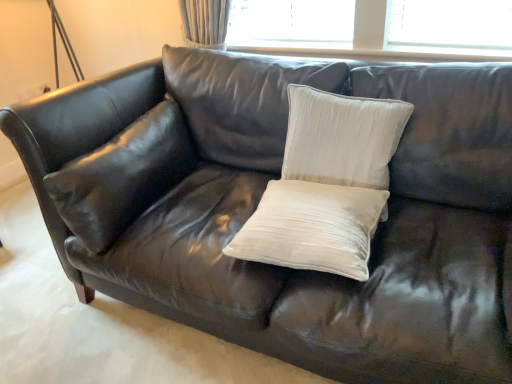
What do you see at coordinates (123, 176) in the screenshot? The width and height of the screenshot is (512, 384). I see `satin white pillow at center, which is the 1th pillow from left to right` at bounding box center [123, 176].

Where is `satin white pillow at center, which ranks as the second pillow in right-to-left order`? satin white pillow at center, which ranks as the second pillow in right-to-left order is located at coordinates (312, 228).

Is satin white pillow at center, acting as the 2th pillow starting from the left, oriented away from satin white pillow at center, which is the 1th pillow from left to right?

satin white pillow at center, acting as the 2th pillow starting from the left, is not turned away from satin white pillow at center, which is the 1th pillow from left to right.

Does point (263, 222) come farther from viewer compared to point (124, 209)?

No, (263, 222) is in front of (124, 209).

Considering the sizes of objects satin white pillow at center, acting as the 2th pillow starting from the left, and satin white pillow at center, which is counted as the third pillow, starting from the right, in the image provided, who is shorter, satin white pillow at center, acting as the 2th pillow starting from the left, or satin white pillow at center, which is counted as the third pillow, starting from the right,?

Standing shorter between the two is satin white pillow at center, acting as the 2th pillow starting from the left.

Between satin white pillow at center, acting as the 2th pillow starting from the left, and satin white pillow at center, which is counted as the third pillow, starting from the right, which one has smaller size?

With smaller size is satin white pillow at center, acting as the 2th pillow starting from the left.

In the scene shown: Considering the relative sizes of satin white pillow at center, which is counted as the third pillow, starting from the right, and satin white pillow at center, acting as the 2th pillow starting from the left, in the image provided, is satin white pillow at center, which is counted as the third pillow, starting from the right, shorter than satin white pillow at center, acting as the 2th pillow starting from the left,?

No, satin white pillow at center, which is counted as the third pillow, starting from the right, is not shorter than satin white pillow at center, acting as the 2th pillow starting from the left.

From a real-world perspective, which is physically above, satin white pillow at center, which is the 1th pillow from left to right, or satin white pillow at center, which ranks as the second pillow in right-to-left order?

In real-world perspective, satin white pillow at center, which is the 1th pillow from left to right, is above.

Is satin white pillow at center, which is the 1th pillow from left to right, thinner than satin white pillow at center, which ranks as the second pillow in right-to-left order?

Yes.

Is satin white pillow at center, which is the 1th pillow from left to right, surrounding satin white pillow at center, which ranks as the second pillow in right-to-left order?

No, satin white pillow at center, which ranks as the second pillow in right-to-left order, is not a part of satin white pillow at center, which is the 1th pillow from left to right.

Which object is positioned more to the left, white velvet pillow at center, arranged as the 1th pillow when viewed from the right, or satin white pillow at center, which is the 1th pillow from left to right?

From the viewer's perspective, satin white pillow at center, which is the 1th pillow from left to right, appears more on the left side.

Looking at this image, is white velvet pillow at center, which is counted as the third pillow, starting from the left, far away from satin white pillow at center, which is the 1th pillow from left to right?

They are positioned close to each other.

Is white velvet pillow at center, which is counted as the third pillow, starting from the left, not inside satin white pillow at center, which is counted as the third pillow, starting from the right?

Indeed, white velvet pillow at center, which is counted as the third pillow, starting from the left, is completely outside satin white pillow at center, which is counted as the third pillow, starting from the right.

Considering the positions of points (340, 99) and (364, 257), is point (340, 99) farther from camera compared to point (364, 257)?

Yes.

From a real-world perspective, is white velvet pillow at center, which is counted as the third pillow, starting from the left, physically below satin white pillow at center, acting as the 2th pillow starting from the left?

No.

Considering the sizes of objects white velvet pillow at center, which is counted as the third pillow, starting from the left, and satin white pillow at center, acting as the 2th pillow starting from the left, in the image provided, who is thinner, white velvet pillow at center, which is counted as the third pillow, starting from the left, or satin white pillow at center, acting as the 2th pillow starting from the left,?

white velvet pillow at center, which is counted as the third pillow, starting from the left, is thinner.

Is white velvet pillow at center, arranged as the 1th pillow when viewed from the right, located outside satin white pillow at center, acting as the 2th pillow starting from the left?

Yes.

Is satin white pillow at center, which is counted as the third pillow, starting from the right, thinner than white velvet pillow at center, which is counted as the third pillow, starting from the left?

In fact, satin white pillow at center, which is counted as the third pillow, starting from the right, might be wider than white velvet pillow at center, which is counted as the third pillow, starting from the left.

From a real-world perspective, is satin white pillow at center, which is the 1th pillow from left to right, beneath white velvet pillow at center, which is counted as the third pillow, starting from the left?

Indeed, from a real-world perspective, satin white pillow at center, which is the 1th pillow from left to right, is positioned beneath white velvet pillow at center, which is counted as the third pillow, starting from the left.

Is satin white pillow at center, which is the 1th pillow from left to right, facing away from white velvet pillow at center, which is counted as the third pillow, starting from the left?

No, white velvet pillow at center, which is counted as the third pillow, starting from the left, is not at the back of satin white pillow at center, which is the 1th pillow from left to right.

From the image's perspective, is satin white pillow at center, which is the 1th pillow from left to right, located above or below white velvet pillow at center, arranged as the 1th pillow when viewed from the right?

Based on their image positions, satin white pillow at center, which is the 1th pillow from left to right, is located beneath white velvet pillow at center, arranged as the 1th pillow when viewed from the right.

Is satin white pillow at center, acting as the 2th pillow starting from the left, completely or partially outside of white velvet pillow at center, arranged as the 1th pillow when viewed from the right?

Yes, satin white pillow at center, acting as the 2th pillow starting from the left, is not within white velvet pillow at center, arranged as the 1th pillow when viewed from the right.

Which object is wider, satin white pillow at center, which ranks as the second pillow in right-to-left order, or white velvet pillow at center, arranged as the 1th pillow when viewed from the right?

satin white pillow at center, which ranks as the second pillow in right-to-left order.

Consider the image. Which is more distant, (238, 257) or (369, 173)?

The point (369, 173) is farther.

Identify the location of pillow on the left of satin white pillow at center, which ranks as the second pillow in right-to-left order. The height and width of the screenshot is (384, 512). (123, 176).

Locate an element on the screen. the 2nd pillow behind the satin white pillow at center, which ranks as the second pillow in right-to-left order, counting from the anchor's position is located at coordinates (123, 176).

Estimate the real-world distances between objects in this image. Which object is further from satin white pillow at center, which is the 1th pillow from left to right, satin white pillow at center, which ranks as the second pillow in right-to-left order, or white velvet pillow at center, arranged as the 1th pillow when viewed from the right?

Among the two, white velvet pillow at center, arranged as the 1th pillow when viewed from the right, is located further to satin white pillow at center, which is the 1th pillow from left to right.

Estimate the real-world distances between objects in this image. Which object is closer to satin white pillow at center, acting as the 2th pillow starting from the left, satin white pillow at center, which is counted as the third pillow, starting from the right, or white velvet pillow at center, which is counted as the third pillow, starting from the left?

white velvet pillow at center, which is counted as the third pillow, starting from the left.

In the scene shown: Estimate the real-world distances between objects in this image. Which object is closer to satin white pillow at center, which ranks as the second pillow in right-to-left order, white velvet pillow at center, which is counted as the third pillow, starting from the left, or satin white pillow at center, which is counted as the third pillow, starting from the right?

Based on the image, white velvet pillow at center, which is counted as the third pillow, starting from the left, appears to be nearer to satin white pillow at center, which ranks as the second pillow in right-to-left order.

Based on their spatial positions, is satin white pillow at center, acting as the 2th pillow starting from the left, or satin white pillow at center, which is the 1th pillow from left to right, further from white velvet pillow at center, which is counted as the third pillow, starting from the left?

satin white pillow at center, which is the 1th pillow from left to right, is further to white velvet pillow at center, which is counted as the third pillow, starting from the left.

Considering their positions, is white velvet pillow at center, arranged as the 1th pillow when viewed from the right, positioned closer to satin white pillow at center, which is the 1th pillow from left to right, than satin white pillow at center, which ranks as the second pillow in right-to-left order?

satin white pillow at center, which ranks as the second pillow in right-to-left order.

Looking at the image, which one is located closer to white velvet pillow at center, which is counted as the third pillow, starting from the left, satin white pillow at center, which is counted as the third pillow, starting from the right, or satin white pillow at center, which ranks as the second pillow in right-to-left order?

satin white pillow at center, which ranks as the second pillow in right-to-left order.

This screenshot has height=384, width=512. Identify the location of pillow located between satin white pillow at center, which is the 1th pillow from left to right, and white velvet pillow at center, which is counted as the third pillow, starting from the left, in the left-right direction. (312, 228).